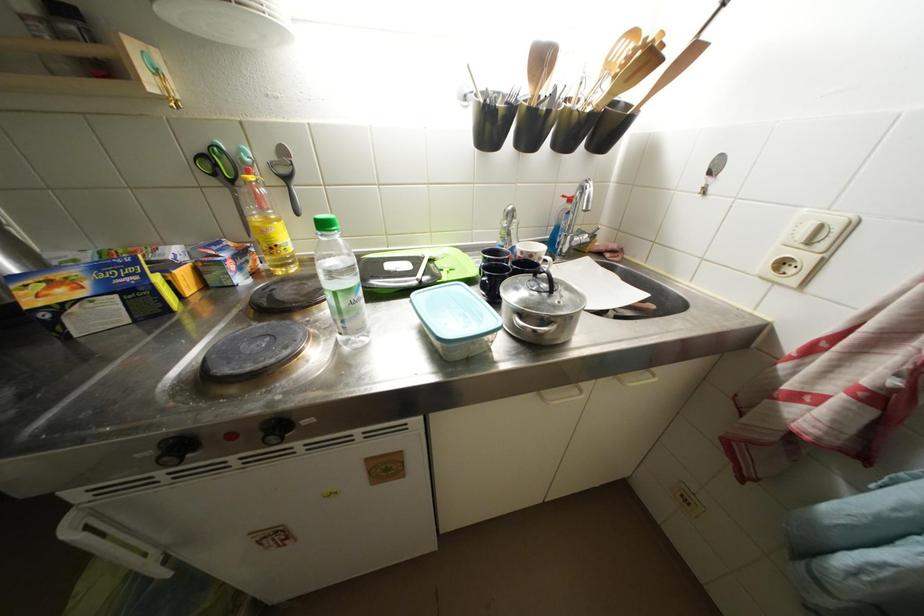
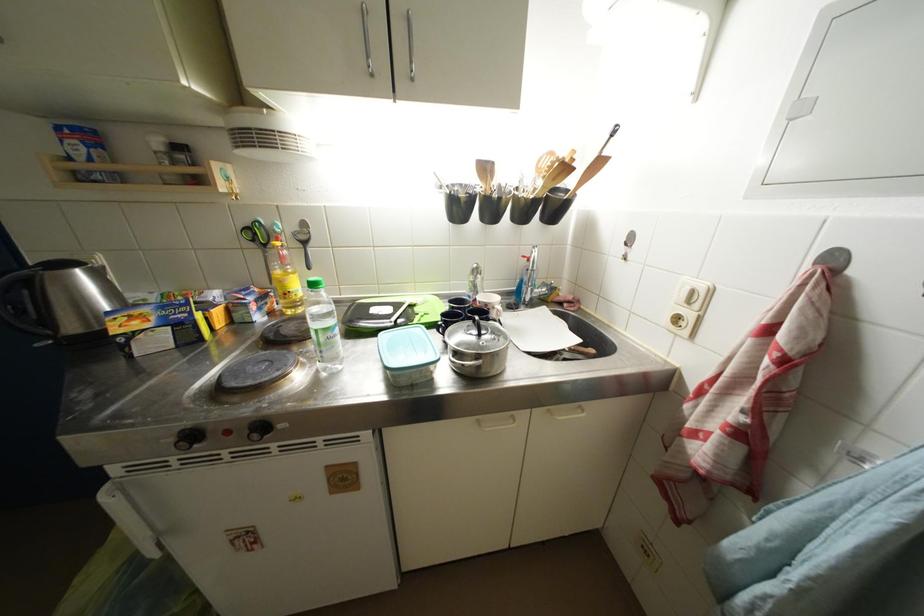
Where in the second image is the point corresponding to (515,238) from the first image?

(481, 291)